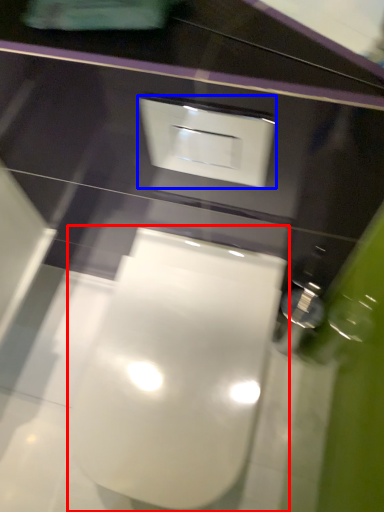
Question: Among these objects, which one is nearest to the camera, toilet (highlighted by a red box) or square (highlighted by a blue box)?

Choices:
 (A) toilet
 (B) square

Answer: (B)